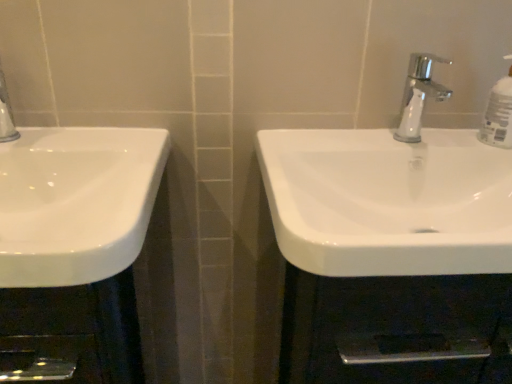
Question: Does white glossy sink at center, which appears as the first sink when viewed from the right, have a lesser width compared to chrome metallic faucet at upper center?

Choices:
 (A) no
 (B) yes

Answer: (A)

Question: Is white glossy sink at center, the 2th sink when ordered from left to right, turned away from chrome metallic faucet at upper center?

Choices:
 (A) no
 (B) yes

Answer: (A)

Question: From a real-world perspective, is white glossy sink at center, which appears as the first sink when viewed from the right, positioned over chrome metallic faucet at upper center based on gravity?

Choices:
 (A) yes
 (B) no

Answer: (B)

Question: Does white glossy sink at center, which appears as the first sink when viewed from the right, have a smaller size compared to chrome metallic faucet at upper center?

Choices:
 (A) no
 (B) yes

Answer: (A)

Question: Can you confirm if white glossy sink at center, which appears as the first sink when viewed from the right, is bigger than chrome metallic faucet at upper center?

Choices:
 (A) no
 (B) yes

Answer: (B)

Question: Is white glossy sink at center, the 2th sink when ordered from left to right, outside of chrome metallic faucet at upper center?

Choices:
 (A) no
 (B) yes

Answer: (B)

Question: From the image's perspective, is white glossy sink at left, placed as the second sink when sorted from right to left, located beneath clear plastic bottle at upper right?

Choices:
 (A) no
 (B) yes

Answer: (B)

Question: From a real-world perspective, is white glossy sink at left, placed as the second sink when sorted from right to left, under clear plastic bottle at upper right?

Choices:
 (A) yes
 (B) no

Answer: (A)

Question: Does white glossy sink at left, which is the first sink in left-to-right order, appear on the left side of clear plastic bottle at upper right?

Choices:
 (A) yes
 (B) no

Answer: (A)

Question: Would you say clear plastic bottle at upper right is part of white glossy sink at left, which is the first sink in left-to-right order,'s contents?

Choices:
 (A) yes
 (B) no

Answer: (B)

Question: Does white glossy sink at left, placed as the second sink when sorted from right to left, have a greater width compared to clear plastic bottle at upper right?

Choices:
 (A) yes
 (B) no

Answer: (A)

Question: Can you confirm if white glossy sink at left, which is the first sink in left-to-right order, is smaller than clear plastic bottle at upper right?

Choices:
 (A) yes
 (B) no

Answer: (B)

Question: Is white glossy sink at center, which appears as the first sink when viewed from the right, facing away from clear plastic bottle at upper right?

Choices:
 (A) yes
 (B) no

Answer: (B)